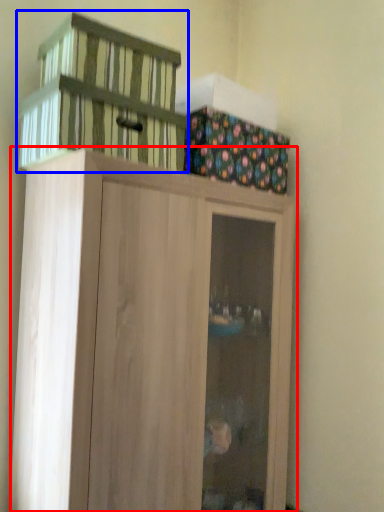
Question: Which of the following is the closest to the observer, cupboard (highlighted by a red box) or basket (highlighted by a blue box)?

Choices:
 (A) cupboard
 (B) basket

Answer: (A)